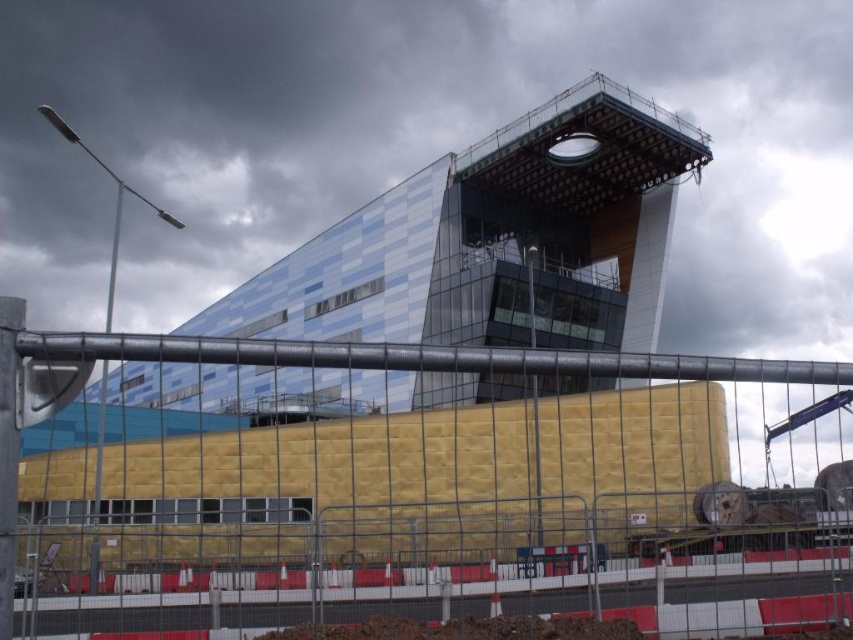
You are a construction inspector assessing the site. You notice the blue glass building at upper center and the yellow insulation board at center. Which object would require more materials for its construction based on their sizes?

The blue glass building at upper center has a larger size compared to the yellow insulation board at center, so it would require more materials for its construction.

You are a construction inspector standing at the entrance of the site. You notice the blue glass building at upper center and the yellow insulation board at center. Which object is positioned to the left when viewed from your perspective?

The blue glass building at upper center is to the left of the yellow insulation board at center, so it is positioned to the left when viewed from your perspective.